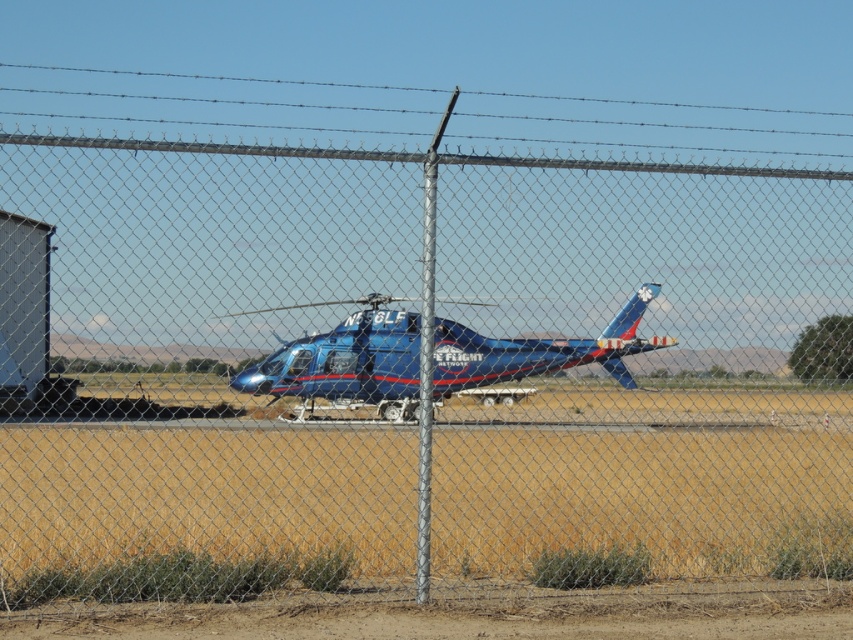
You are a delivery driver who needs to back up your metallic blue trailer truck at left to load cargo onto the blue glossy helicopter at center. The minimum safe distance required for backing up is 8 meters. Based on the scene, can you safely back up your truck?

The distance between the blue glossy helicopter at center and the metallic blue trailer truck at left is 7.72 meters, which is less than the required 8 meters. Therefore, you cannot safely back up your truck to load cargo onto the helicopter.

You are standing in front of a chain link fence that partially blocks your view of the blue glossy helicopter at center. If you want to see the entire helicopter, which direction should you move relative to the fence?

You should move to the left or right of the chain link fence to get a full view of the blue glossy helicopter at center.

You are standing near the fence and want to take a photo of both the blue glossy helicopter at center and the metallic blue trailer truck at left. Which object should you position yourself closer to in order to include both in the frame without moving the camera?

You should position yourself closer to the metallic blue trailer truck at left because the blue glossy helicopter at center is to the right of it, allowing both to be captured in the frame when centered on the truck.